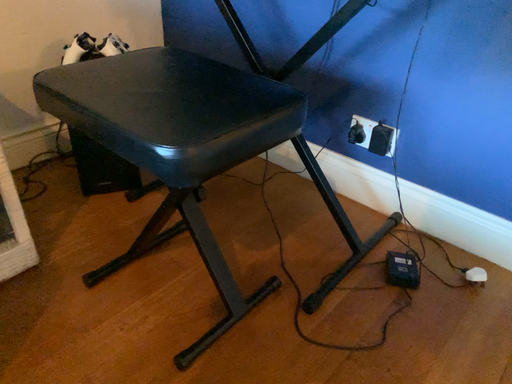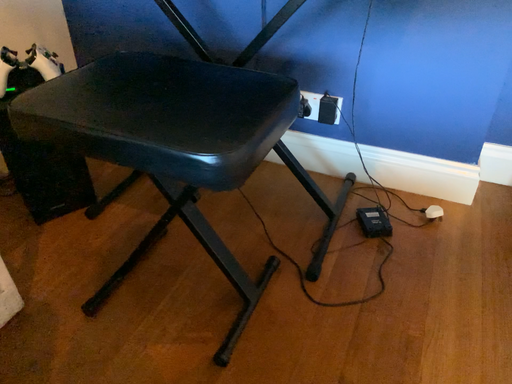
Question: Which way did the camera rotate in the video?

Choices:
 (A) rotated right
 (B) rotated left

Answer: (A)